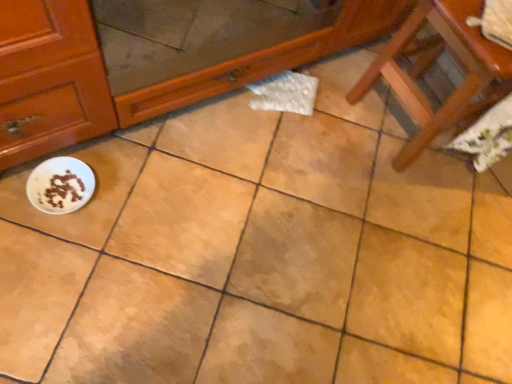
Question: Is wooden chair at lower right turned away from white glossy bowl at lower left?

Choices:
 (A) yes
 (B) no

Answer: (B)

Question: Is wooden chair at lower right further to camera compared to white glossy bowl at lower left?

Choices:
 (A) no
 (B) yes

Answer: (A)

Question: From the image's perspective, is wooden chair at lower right below white glossy bowl at lower left?

Choices:
 (A) no
 (B) yes

Answer: (A)

Question: Would you say white glossy bowl at lower left is part of wooden chair at lower right's contents?

Choices:
 (A) no
 (B) yes

Answer: (A)

Question: From a real-world perspective, does wooden chair at lower right stand above white glossy bowl at lower left?

Choices:
 (A) yes
 (B) no

Answer: (A)

Question: Is wooden chair at lower right not near white glossy bowl at lower left?

Choices:
 (A) yes
 (B) no

Answer: (B)

Question: Is white glossy bowl at lower left facing away from wooden chair at lower right?

Choices:
 (A) no
 (B) yes

Answer: (A)

Question: Is white glossy bowl at lower left beside wooden chair at lower right?

Choices:
 (A) yes
 (B) no

Answer: (B)

Question: From the image's perspective, is white glossy bowl at lower left above wooden chair at lower right?

Choices:
 (A) yes
 (B) no

Answer: (B)

Question: Considering the relative sizes of white glossy bowl at lower left and wooden chair at lower right in the image provided, is white glossy bowl at lower left smaller than wooden chair at lower right?

Choices:
 (A) no
 (B) yes

Answer: (B)

Question: Could wooden chair at lower right be considered to be inside white glossy bowl at lower left?

Choices:
 (A) yes
 (B) no

Answer: (B)

Question: Is white glossy bowl at lower left positioned behind wooden chair at lower right?

Choices:
 (A) yes
 (B) no

Answer: (A)

Question: In terms of size, does white glossy bowl at lower left appear bigger or smaller than wooden chair at lower right?

Choices:
 (A) small
 (B) big

Answer: (A)